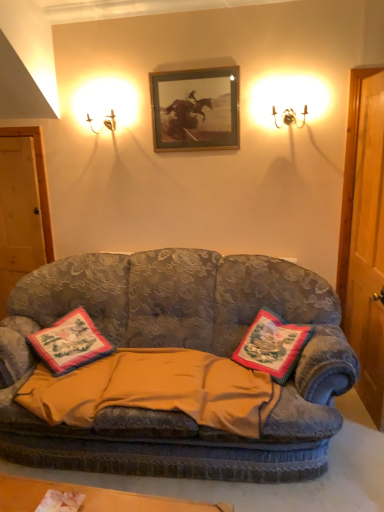
What do you see at coordinates (22, 208) in the screenshot? I see `wooden door at left` at bounding box center [22, 208].

What is the approximate width of gold-framed picture at upper center?

The width of gold-framed picture at upper center is 1.58 inches.

The image size is (384, 512). Describe the element at coordinates (179, 347) in the screenshot. I see `velvet fabric couch at center` at that location.

What do you see at coordinates (272, 345) in the screenshot?
I see `embroidered fabric pillow at center, which ranks as the first pillow in right-to-left order` at bounding box center [272, 345].

The width and height of the screenshot is (384, 512). Describe the element at coordinates (106, 104) in the screenshot. I see `metallic wall sconce at upper left` at that location.

What do you see at coordinates (156, 389) in the screenshot? I see `yellow cotton blanket at center` at bounding box center [156, 389].

This screenshot has height=512, width=384. Identify the location of wooden door at left. (22, 208).

Does wooden door at left have a larger size compared to velvet fabric couch at center?

Actually, wooden door at left might be smaller than velvet fabric couch at center.

From the image's perspective, is wooden door at left above or below velvet fabric couch at center?

wooden door at left is above velvet fabric couch at center.

Is wooden door at left touching velvet fabric couch at center?

wooden door at left is not next to velvet fabric couch at center, and they're not touching.

Does wooden door at left lie behind velvet fabric couch at center?

That is True.

Which is correct: yellow cotton blanket at center is inside wooden door at left, or outside of it?

yellow cotton blanket at center cannot be found inside wooden door at left.

Which object is positioned more to the left, yellow cotton blanket at center or wooden door at left?

wooden door at left.

Is embroidered fabric pillow at center, the 2th pillow viewed from the right, facing away from metallic wall sconce at upper left?

No, metallic wall sconce at upper left is not at the back of embroidered fabric pillow at center, the 2th pillow viewed from the right.

Considering the relative sizes of embroidered fabric pillow at center, the 2th pillow viewed from the right, and metallic wall sconce at upper left in the image provided, is embroidered fabric pillow at center, the 2th pillow viewed from the right, thinner than metallic wall sconce at upper left?

Incorrect, the width of embroidered fabric pillow at center, the 2th pillow viewed from the right, is not less than that of metallic wall sconce at upper left.

Is embroidered fabric pillow at center, the first pillow viewed from the left, turned away from wooden door at left?

That's right, embroidered fabric pillow at center, the first pillow viewed from the left, is facing away from wooden door at left.

Looking at this image, which object is closer to the camera taking this photo, embroidered fabric pillow at center, the first pillow viewed from the left, or wooden door at left?

embroidered fabric pillow at center, the first pillow viewed from the left, is in front.

Which is correct: embroidered fabric pillow at center, the 2th pillow viewed from the right, is inside wooden door at left, or outside of it?

embroidered fabric pillow at center, the 2th pillow viewed from the right, is outside wooden door at left.

Is metallic wall sconce at upper left in contact with gold-framed picture at upper center?

metallic wall sconce at upper left and gold-framed picture at upper center are clearly separated.

From the image's perspective, is metallic wall sconce at upper left located above or below gold-framed picture at upper center?

metallic wall sconce at upper left is below gold-framed picture at upper center.

What's the angular difference between metallic wall sconce at upper left and gold-framed picture at upper center's facing directions?

metallic wall sconce at upper left and gold-framed picture at upper center are facing 0.662 degrees away from each other.

Where is `lighting that is below the gold-framed picture at upper center (from the image's perspective)`? This screenshot has width=384, height=512. lighting that is below the gold-framed picture at upper center (from the image's perspective) is located at coordinates point(106,104).

Do you think gold-framed picture at upper center is within velvet fabric couch at center, or outside of it?

gold-framed picture at upper center is spatially situated outside velvet fabric couch at center.

Between gold-framed picture at upper center and velvet fabric couch at center, which one is positioned behind?

gold-framed picture at upper center is further away from the camera.

In the scene shown: Is gold-framed picture at upper center oriented away from velvet fabric couch at center?

No, velvet fabric couch at center is not at the back of gold-framed picture at upper center.

How many degrees apart are the facing directions of gold-framed picture at upper center and velvet fabric couch at center?

The angle between the facing direction of gold-framed picture at upper center and the facing direction of velvet fabric couch at center is 6.1 degrees.

Who is taller, velvet fabric couch at center or gold-framed picture at upper center?

velvet fabric couch at center is taller.

Where is `picture frame that appears above the velvet fabric couch at center (from the image's perspective)`? picture frame that appears above the velvet fabric couch at center (from the image's perspective) is located at coordinates (195, 109).

Is velvet fabric couch at center looking in the opposite direction of gold-framed picture at upper center?

No, velvet fabric couch at center is not facing the opposite direction of gold-framed picture at upper center.

Based on the photo, between velvet fabric couch at center and gold-framed picture at upper center, which one has smaller size?

gold-framed picture at upper center.

Where is `door that appears behind the velvet fabric couch at center`? Image resolution: width=384 pixels, height=512 pixels. door that appears behind the velvet fabric couch at center is located at coordinates (22, 208).

Where is `blanket located in front of the wooden door at left`? The width and height of the screenshot is (384, 512). blanket located in front of the wooden door at left is located at coordinates (156, 389).

From the picture: Based on their spatial positions, is velvet fabric couch at center or metallic wall sconce at upper left closer to wooden door at left?

Among the two, metallic wall sconce at upper left is located nearer to wooden door at left.

Based on their spatial positions, is wooden door at left or velvet fabric couch at center closer to embroidered fabric pillow at center, the second pillow when ordered from left to right?

velvet fabric couch at center lies closer to embroidered fabric pillow at center, the second pillow when ordered from left to right, than the other object.

Based on their spatial positions, is metallic wall sconce at upper left or yellow cotton blanket at center closer to embroidered fabric pillow at center, the 2th pillow viewed from the right?

yellow cotton blanket at center is closer to embroidered fabric pillow at center, the 2th pillow viewed from the right.

Which object lies further to the anchor point wooden door at left, yellow cotton blanket at center or metallic wall sconce at upper left?

yellow cotton blanket at center lies further to wooden door at left than the other object.

Consider the image. Based on their spatial positions, is embroidered fabric pillow at center, the first pillow viewed from the left, or yellow cotton blanket at center closer to wooden door at left?

embroidered fabric pillow at center, the first pillow viewed from the left, is closer to wooden door at left.

Estimate the real-world distances between objects in this image. Which object is further from embroidered fabric pillow at center, which ranks as the first pillow in right-to-left order, wooden door at left or embroidered fabric pillow at center, the first pillow viewed from the left?

wooden door at left is positioned further to the anchor embroidered fabric pillow at center, which ranks as the first pillow in right-to-left order.

Which object lies further to the anchor point wooden door at left, embroidered fabric pillow at center, the second pillow when ordered from left to right, or yellow cotton blanket at center?

embroidered fabric pillow at center, the second pillow when ordered from left to right.

Considering their positions, is metallic wall sconce at upper left positioned further to velvet fabric couch at center than gold-framed picture at upper center?

metallic wall sconce at upper left is further to velvet fabric couch at center.

Where is `blanket between embroidered fabric pillow at center, the first pillow viewed from the left, and embroidered fabric pillow at center, which ranks as the first pillow in right-to-left order, from left to right`? This screenshot has width=384, height=512. blanket between embroidered fabric pillow at center, the first pillow viewed from the left, and embroidered fabric pillow at center, which ranks as the first pillow in right-to-left order, from left to right is located at coordinates (156, 389).

Locate an element on the screen. The width and height of the screenshot is (384, 512). studio couch between wooden door at left and gold-framed picture at upper center is located at coordinates (179, 347).

Where is `lighting between gold-framed picture at upper center and yellow cotton blanket at center from top to bottom`? The height and width of the screenshot is (512, 384). lighting between gold-framed picture at upper center and yellow cotton blanket at center from top to bottom is located at coordinates (106, 104).

Locate an element on the screen. The image size is (384, 512). blanket between velvet fabric couch at center and wooden door at left along the z-axis is located at coordinates (156, 389).